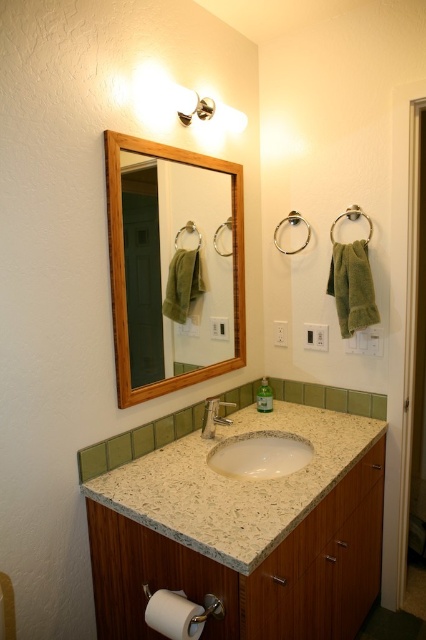
Question: Which point is farther to the camera?

Choices:
 (A) wooden frame mirror at center
 (B) white granite sink at center
 (C) green matte soap dispenser at center
 (D) white speckled granite at center

Answer: (C)

Question: Does white speckled granite at center appear on the left side of white granite sink at center?

Choices:
 (A) no
 (B) yes

Answer: (A)

Question: Can you confirm if silver metallic faucet at center is bigger than green matte soap dispenser at center?

Choices:
 (A) yes
 (B) no

Answer: (A)

Question: Estimate the real-world distances between objects in this image. Which object is farther from the silver metallic faucet at center?

Choices:
 (A) white speckled granite at center
 (B) green matte soap dispenser at center

Answer: (A)

Question: Which object is the closest to the white granite sink at center?

Choices:
 (A) white matte toilet paper at lower left
 (B) silver metallic faucet at center

Answer: (B)

Question: Is white granite sink at center positioned at the back of white matte toilet paper at lower left?

Choices:
 (A) no
 (B) yes

Answer: (B)